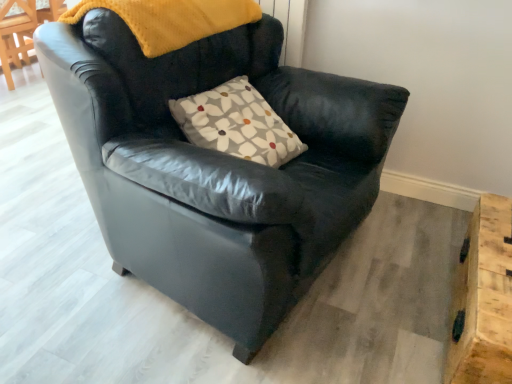
Question: Does black leather armchair at center have a greater height compared to wooden at lower right?

Choices:
 (A) yes
 (B) no

Answer: (A)

Question: Considering the relative sizes of black leather armchair at center and wooden at lower right in the image provided, is black leather armchair at center thinner than wooden at lower right?

Choices:
 (A) yes
 (B) no

Answer: (B)

Question: Considering the relative positions of black leather armchair at center and wooden at lower right in the image provided, is black leather armchair at center to the right of wooden at lower right from the viewer's perspective?

Choices:
 (A) no
 (B) yes

Answer: (A)

Question: Is black leather armchair at center bigger than wooden at lower right?

Choices:
 (A) no
 (B) yes

Answer: (B)

Question: Is black leather armchair at center located outside wooden at lower right?

Choices:
 (A) no
 (B) yes

Answer: (B)

Question: Is black leather armchair at center smaller than wooden at lower right?

Choices:
 (A) no
 (B) yes

Answer: (A)

Question: Can you confirm if floral-patterned fabric pillow at center is positioned to the left of wooden at lower right?

Choices:
 (A) yes
 (B) no

Answer: (A)

Question: From the image's perspective, does floral-patterned fabric pillow at center appear lower than wooden at lower right?

Choices:
 (A) no
 (B) yes

Answer: (A)

Question: Are floral-patterned fabric pillow at center and wooden at lower right beside each other?

Choices:
 (A) no
 (B) yes

Answer: (A)

Question: Does floral-patterned fabric pillow at center lie behind wooden at lower right?

Choices:
 (A) yes
 (B) no

Answer: (A)

Question: Considering the relative sizes of floral-patterned fabric pillow at center and wooden at lower right in the image provided, is floral-patterned fabric pillow at center thinner than wooden at lower right?

Choices:
 (A) yes
 (B) no

Answer: (A)

Question: Is wooden at lower right inside floral-patterned fabric pillow at center?

Choices:
 (A) no
 (B) yes

Answer: (A)

Question: Does black leather armchair at center have a greater height compared to floral-patterned fabric pillow at center?

Choices:
 (A) no
 (B) yes

Answer: (B)